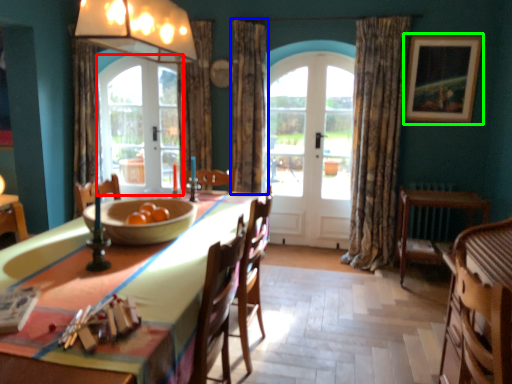
Question: Based on their relative distances, which object is farther from screen door (highlighted by a red box)? Choose from curtain (highlighted by a blue box) and picture frame (highlighted by a green box).

Choices:
 (A) curtain
 (B) picture frame

Answer: (B)